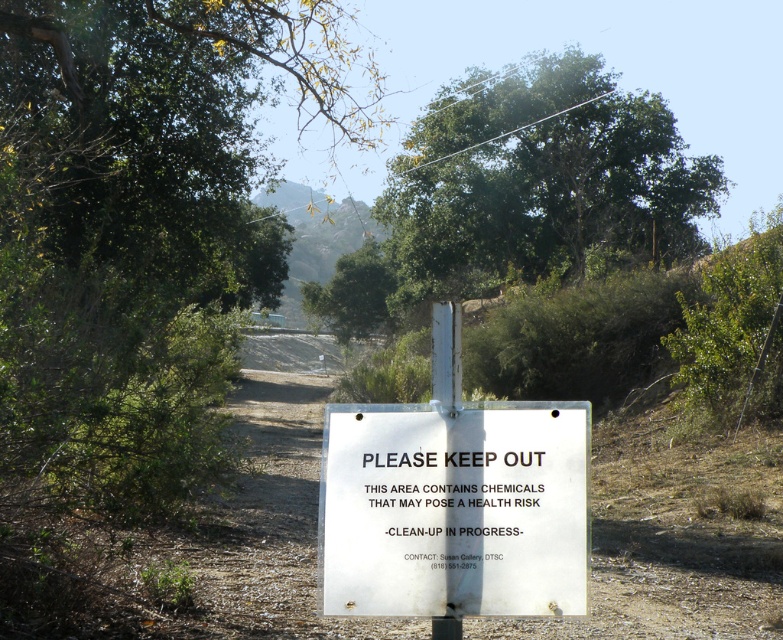
Question: From the image, what is the correct spatial relationship of green leafy tree at upper center in relation to white paper sign at center?

Choices:
 (A) left
 (B) right

Answer: (B)

Question: Does green leafy tree at upper center appear under white paper sign at center?

Choices:
 (A) yes
 (B) no

Answer: (B)

Question: Does green leafy tree at upper center have a smaller size compared to white paper sign at center?

Choices:
 (A) no
 (B) yes

Answer: (A)